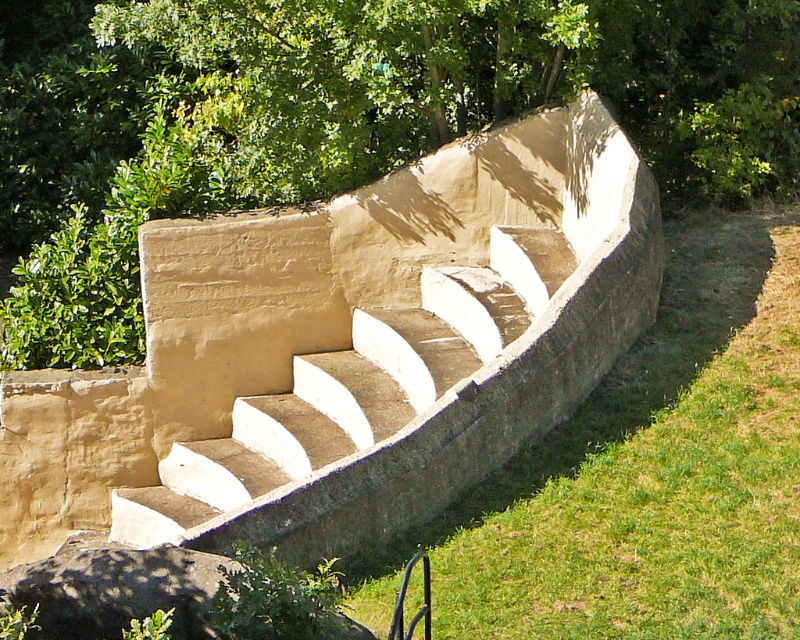
Does green leafy tree at upper center appear on the right side of green grass at lower right?

No, green leafy tree at upper center is not to the right of green grass at lower right.

Is green leafy tree at upper center positioned at the back of green grass at lower right?

Yes.

Who is more forward, (445, 138) or (733, 264)?

Point (733, 264) is more forward.

In order to click on green leafy tree at upper center in this screenshot , I will do `click(337, 118)`.

Describe the element at coordinates (337, 118) in the screenshot. The image size is (800, 640). I see `green leafy tree at upper center` at that location.

Who is shorter, green leafy tree at upper center or beige concrete stairs at center?

With less height is beige concrete stairs at center.

In order to click on green leafy tree at upper center in this screenshot , I will do `click(337, 118)`.

Who is more distant from viewer, (556, 566) or (562, 278)?

Positioned behind is point (562, 278).

Does green grass at lower right have a lesser width compared to beige concrete stairs at center?

Yes, green grass at lower right is thinner than beige concrete stairs at center.

I want to click on green grass at lower right, so click(646, 474).